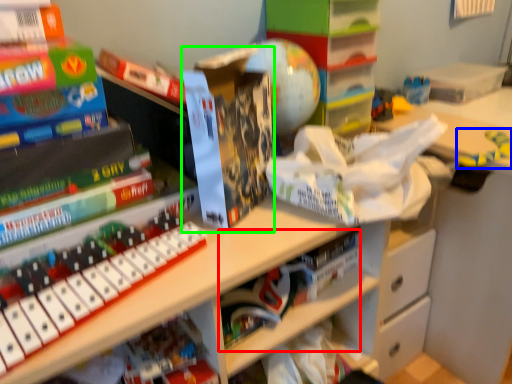
Question: Considering the real-world distances, which object is closest to book (highlighted by a red box)? toy (highlighted by a blue box) or paperback book (highlighted by a green box).

Choices:
 (A) toy
 (B) paperback book

Answer: (B)